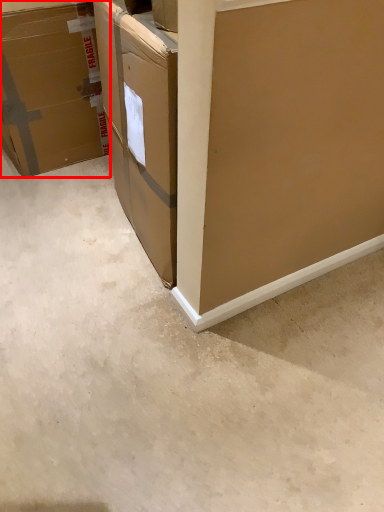
Question: Considering the relative positions of box (annotated by the red box) and concrete in the image provided, where is box (annotated by the red box) located with respect to the staircase?

Choices:
 (A) right
 (B) left

Answer: (B)